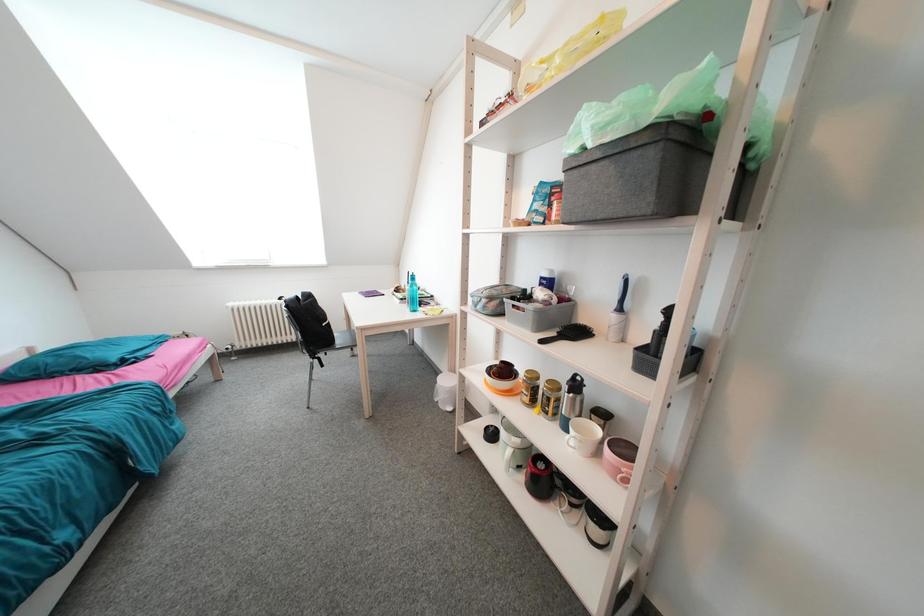
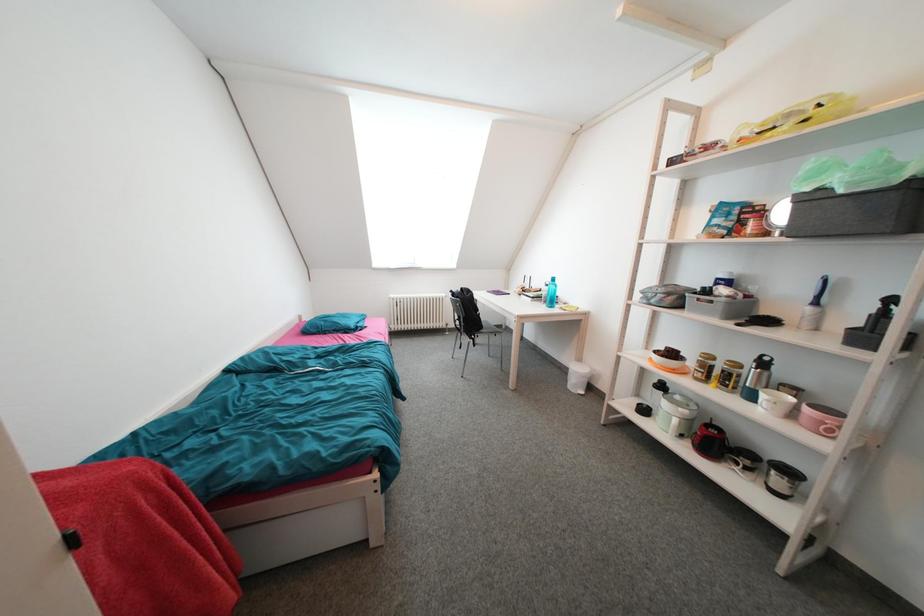
The images are taken continuously from a first-person perspective. In which direction are you moving?

The cameraman moved toward left, backward.